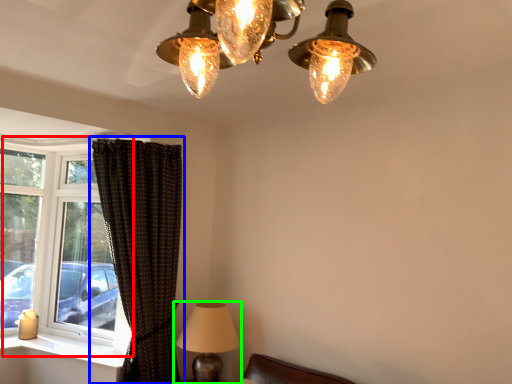
Question: Which object is positioned closest to window (highlighted by a red box)? Select from curtain (highlighted by a blue box) and lamp (highlighted by a green box).

Choices:
 (A) curtain
 (B) lamp

Answer: (A)